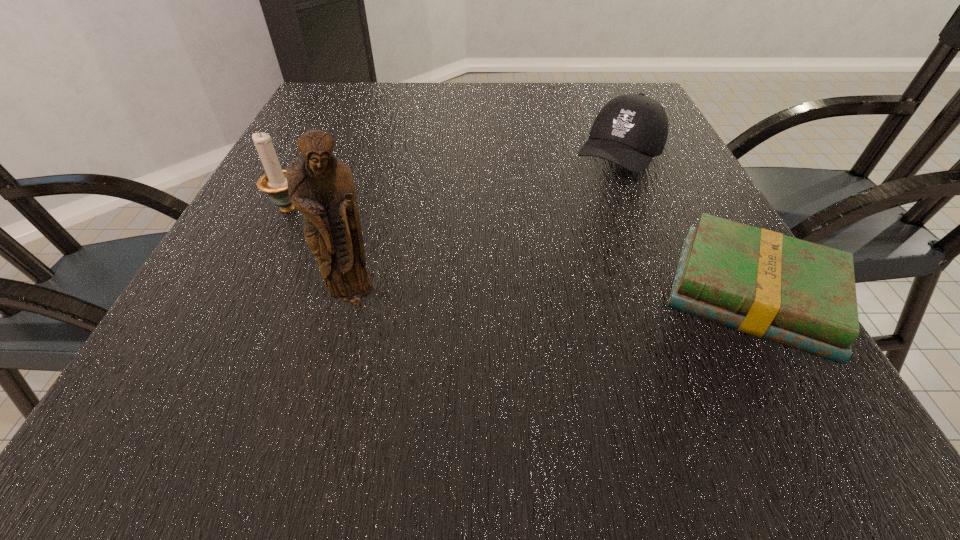
At what (x,y) coordinates should I click in order to perform the action: click on blank area at the far edge. Please return your answer as a coordinate pair (x, y). This screenshot has height=540, width=960. Looking at the image, I should click on [582, 95].

You are a GUI agent. You are given a task and a screenshot of the screen. Output one action in this format:
    pyautogui.click(x=<x>, y=<y>)
    Task: Click on the vacant region at the near edge of the desktop
    This screenshot has width=960, height=540.
    Given the screenshot: What is the action you would take?
    pyautogui.click(x=399, y=374)

In the image, there is a desktop. Identify the location of vacant space at the right edge. This screenshot has height=540, width=960. (640, 187).

At what (x,y) coordinates should I click in order to perform the action: click on vacant space at the near left corner of the desktop. Please return your answer as a coordinate pair (x, y). Looking at the image, I should click on (198, 364).

Image resolution: width=960 pixels, height=540 pixels. I want to click on free space at the far right corner of the desktop, so click(601, 101).

The width and height of the screenshot is (960, 540). In order to click on empty location between the leftmost object and the baseball cap in this screenshot , I will do `click(455, 184)`.

Where is `free area in between the third tallest object and the third shortest object`? The height and width of the screenshot is (540, 960). free area in between the third tallest object and the third shortest object is located at coordinates (455, 184).

Locate an element on the screen. free spot between the shortest object and the third tallest object is located at coordinates (685, 226).

The height and width of the screenshot is (540, 960). Find the location of `empty space between the figurine and the baseball cap`. empty space between the figurine and the baseball cap is located at coordinates (488, 229).

This screenshot has width=960, height=540. I want to click on free space between the baseball cap and the shortest object, so click(685, 226).